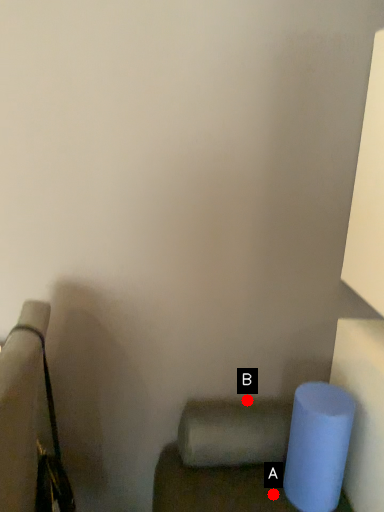
Question: Two points are circled on the image, labeled by A and B beside each circle. Which of the following is the closest to the observer?

Choices:
 (A) A is closer
 (B) B is closer

Answer: (A)